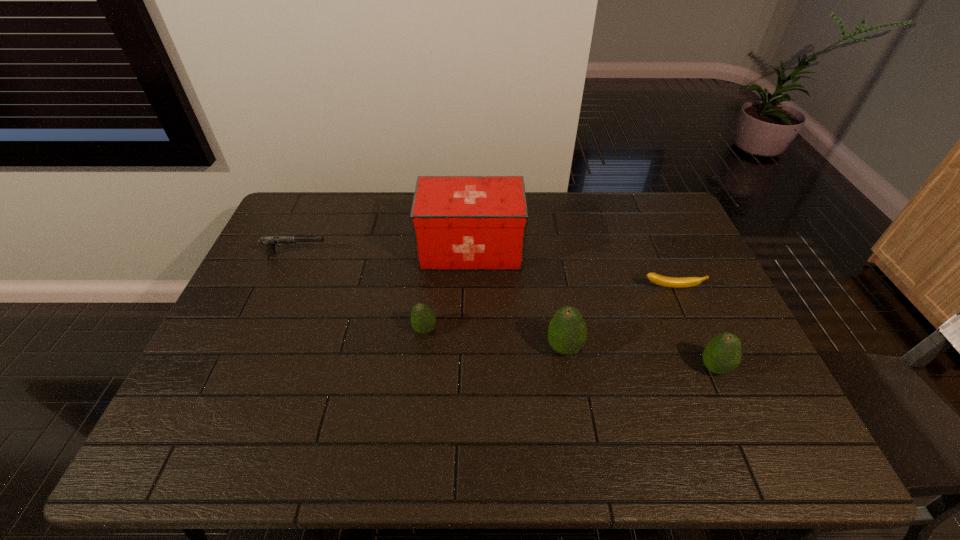
The width and height of the screenshot is (960, 540). Find the location of `the shortest object`. the shortest object is located at coordinates (660, 280).

Where is `free space located 0.280m on the back of the shortest avocado`? free space located 0.280m on the back of the shortest avocado is located at coordinates (433, 253).

Where is `free space located on the back of the tallest avocado`? The width and height of the screenshot is (960, 540). free space located on the back of the tallest avocado is located at coordinates (552, 273).

Locate an element on the screen. free spot located 0.220m on the back of the rightmost avocado is located at coordinates (681, 292).

Locate an element on the screen. The image size is (960, 540). vacant space located at the muzzle end of the gun is located at coordinates (409, 254).

I want to click on vacant space located 0.100m on the handle side of the tallest object, so click(554, 249).

This screenshot has height=540, width=960. In order to click on vacant space situated 0.090m at the stem of the banana in this screenshot , I will do `click(684, 316)`.

The image size is (960, 540). I want to click on object that is at the far edge, so click(459, 222).

I want to click on object that is at the near edge, so click(722, 355).

You are a GUI agent. You are given a task and a screenshot of the screen. Output one action in this format:
    pyautogui.click(x=<x>, y=<y>)
    Task: Click on the object positioned at the left edge
    This screenshot has width=960, height=540.
    Given the screenshot: What is the action you would take?
    pyautogui.click(x=269, y=241)